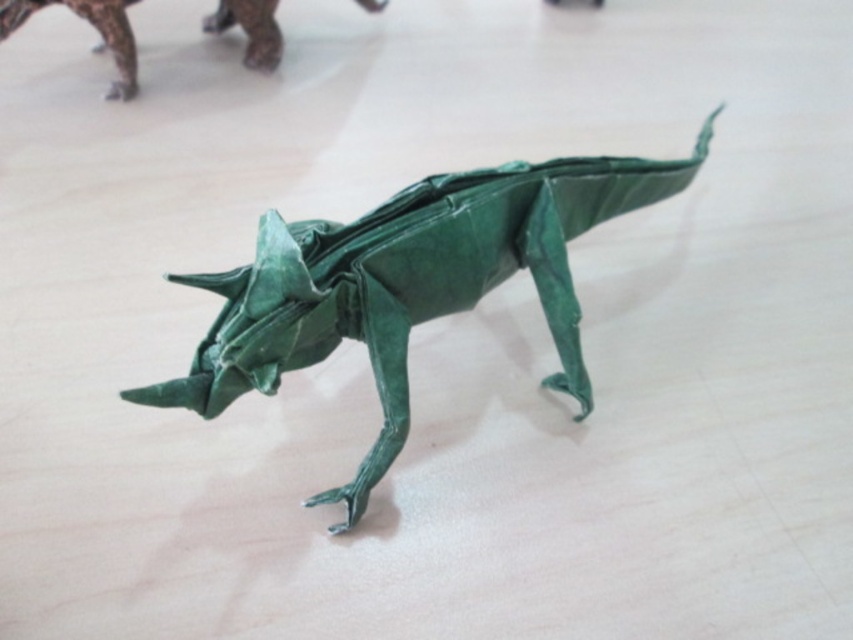
You are an art student observing an origami display. You see the green paper origami dinosaur at center and the green paper dinosaur at upper left. Which one is positioned lower in the image?

The green paper origami dinosaur at center is positioned lower than the green paper dinosaur at upper left.

You are a photographer standing 1 meter away from a wooden table. You want to take a closeup photo of the green paper origami dinosaur at center. Is the current distance sufficient to capture the dinosaur clearly in the frame?

The green paper origami dinosaur at center is 1.11 meters away from the viewer. Since you are standing 1 meter away from the table, you are closer than the required distance, so you need to move back approximately 0.11 meters to ensure the dinosaur is in focus and properly framed.

You are an art curator planning to display the green paper origami dinosaur at center and the green paper dinosaur at upper left in a gallery. The gallery has a rule that any two displayed artworks must be at least 50 centimeters apart. Based on the image, will these two dinosaurs meet the gallery requirement?

The green paper origami dinosaur at center is 53.61 centimeters from the green paper dinosaur at upper left, which exceeds the gallery requirement of 50 centimeters. Therefore, they meet the requirement.